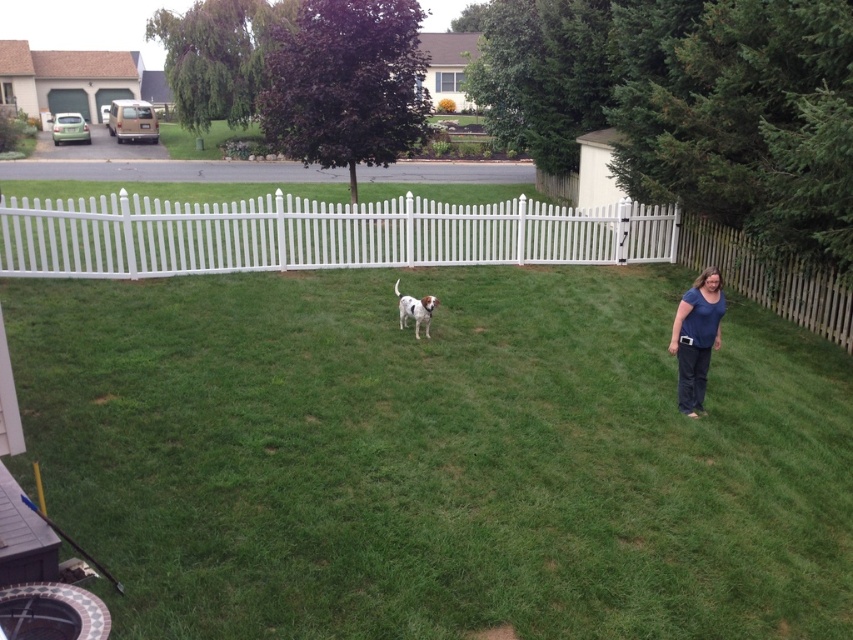
Does blue cotton shirt at center-right have a larger size compared to white speckled fur dog at center?

Yes, blue cotton shirt at center-right is bigger than white speckled fur dog at center.

Can you confirm if blue cotton shirt at center-right is positioned to the left of white speckled fur dog at center?

No, blue cotton shirt at center-right is not to the left of white speckled fur dog at center.

Is point (700, 401) in front of point (418, 300)?

Yes, it is.

Where is `blue cotton shirt at center-right`? The height and width of the screenshot is (640, 853). blue cotton shirt at center-right is located at coordinates (695, 337).

Measure the distance between white plastic picket fence at center and blue cotton shirt at center-right.

white plastic picket fence at center is 28.06 feet from blue cotton shirt at center-right.

Is point (88, 202) farther from camera compared to point (688, 332)?

Yes, it is.

I want to click on white plastic picket fence at center, so click(x=316, y=234).

Does green grass at center have a greater height compared to blue cotton shirt at center-right?

Correct, green grass at center is much taller as blue cotton shirt at center-right.

Does green grass at center have a smaller size compared to blue cotton shirt at center-right?

Incorrect, green grass at center is not smaller in size than blue cotton shirt at center-right.

You are a GUI agent. You are given a task and a screenshot of the screen. Output one action in this format:
    pyautogui.click(x=<x>, y=<y>)
    Task: Click on the green grass at center
    
    Given the screenshot: What is the action you would take?
    pyautogui.click(x=436, y=456)

Image resolution: width=853 pixels, height=640 pixels. What are the coordinates of `green grass at center` in the screenshot? It's located at pos(436,456).